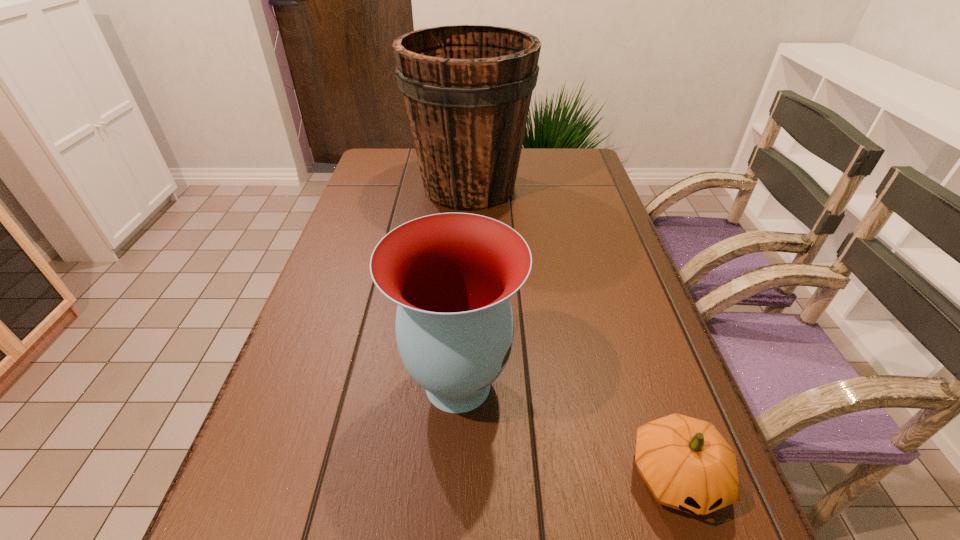
Identify which object is the second nearest to the second tallest object. Please provide its 2D coordinates. Your answer should be formatted as a tuple, i.e. [(x, y)], where the tuple contains the x and y coordinates of a point satisfying the conditions above.

[(467, 89)]